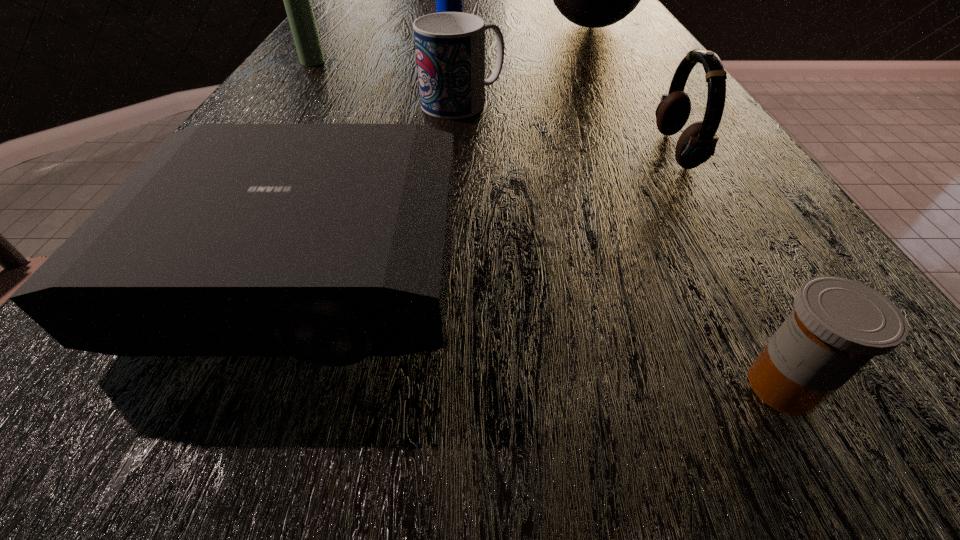
Where is `vacant space that's between the third farthest object and the fifth farthest object`? This screenshot has height=540, width=960. vacant space that's between the third farthest object and the fifth farthest object is located at coordinates (494, 106).

Image resolution: width=960 pixels, height=540 pixels. I want to click on free space between the headset and the projector, so pos(490,211).

Where is `vacant area between the water bottle and the tallest object`? The image size is (960, 540). vacant area between the water bottle and the tallest object is located at coordinates (518, 28).

This screenshot has height=540, width=960. I want to click on vacant area that lies between the projector and the third nearest object, so click(x=490, y=211).

This screenshot has height=540, width=960. I want to click on vacant point located between the projector and the headset, so click(490, 211).

Identify the location of empty space between the fifth farthest object and the tallest object. (631, 90).

Find the location of a particular element. empty space that is in between the third farthest object and the water bottle is located at coordinates (381, 45).

The height and width of the screenshot is (540, 960). I want to click on the fourth closest object to the medicine, so click(594, 0).

This screenshot has height=540, width=960. In order to click on object that stands as the third closest to the headset in this screenshot , I will do (x=328, y=242).

This screenshot has height=540, width=960. Identify the location of vacant space that satisfies the following two spatial constraints: 1. on the front side of the water bottle; 2. on the right side of the mug. (440, 103).